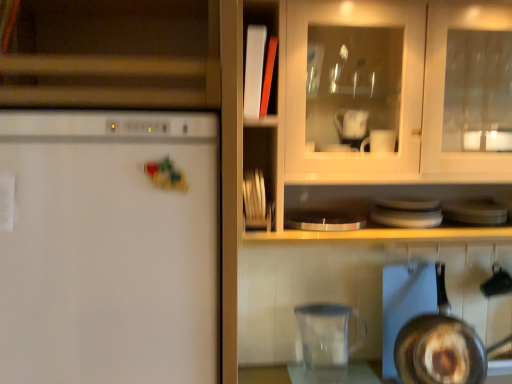
Question: Is matte wood cabinet at upper left not near white matte refrigerator at left?

Choices:
 (A) yes
 (B) no

Answer: (B)

Question: Can you confirm if matte wood cabinet at upper left is smaller than white matte refrigerator at left?

Choices:
 (A) no
 (B) yes

Answer: (B)

Question: Can you confirm if matte wood cabinet at upper left is bigger than white matte refrigerator at left?

Choices:
 (A) no
 (B) yes

Answer: (A)

Question: Is matte wood cabinet at upper left at the left side of white matte refrigerator at left?

Choices:
 (A) yes
 (B) no

Answer: (B)

Question: Is white matte refrigerator at left located within matte wood cabinet at upper left?

Choices:
 (A) yes
 (B) no

Answer: (B)

Question: Is transparent plastic pitcher at lower center inside the boundaries of white matte refrigerator at left, or outside?

Choices:
 (A) inside
 (B) outside

Answer: (B)

Question: Relative to white matte refrigerator at left, is transparent plastic pitcher at lower center in front or behind?

Choices:
 (A) front
 (B) behind

Answer: (B)

Question: Is point (300, 324) closer or farther from the camera than point (2, 256)?

Choices:
 (A) closer
 (B) farther

Answer: (B)

Question: From the image's perspective, is transparent plastic pitcher at lower center located above or below white matte refrigerator at left?

Choices:
 (A) above
 (B) below

Answer: (B)

Question: From their relative heights in the image, would you say white matte refrigerator at left is taller or shorter than matte wood cabinet at upper left?

Choices:
 (A) tall
 (B) short

Answer: (A)

Question: Do you think white matte refrigerator at left is within matte wood cabinet at upper left, or outside of it?

Choices:
 (A) inside
 (B) outside

Answer: (B)

Question: From the image's perspective, is white matte refrigerator at left above or below matte wood cabinet at upper left?

Choices:
 (A) above
 (B) below

Answer: (B)

Question: In terms of width, does white matte refrigerator at left look wider or thinner when compared to matte wood cabinet at upper left?

Choices:
 (A) wide
 (B) thin

Answer: (A)

Question: Based on their positions, is shiny silver frying pan at lower right located to the left or right of white matte refrigerator at left?

Choices:
 (A) right
 (B) left

Answer: (A)

Question: Is shiny silver frying pan at lower right spatially inside white matte refrigerator at left, or outside of it?

Choices:
 (A) inside
 (B) outside

Answer: (B)